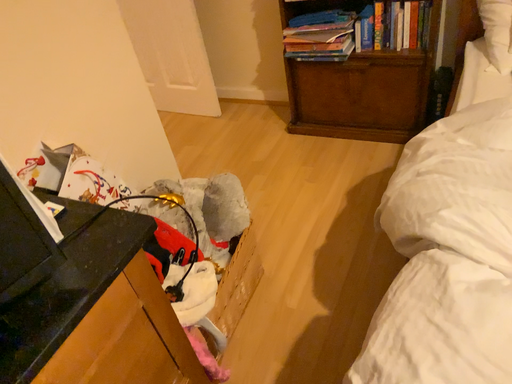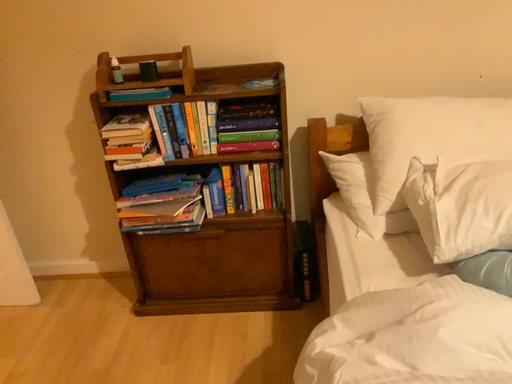
Question: How did the camera likely rotate when shooting the video?

Choices:
 (A) rotated right
 (B) rotated left

Answer: (A)